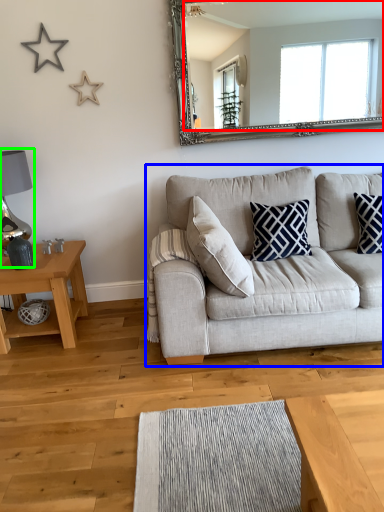
Question: Estimate the real-world distances between objects in this image. Which object is closer to mirror (highlighted by a red box), studio couch (highlighted by a blue box) or lamp (highlighted by a green box)?

Choices:
 (A) studio couch
 (B) lamp

Answer: (A)